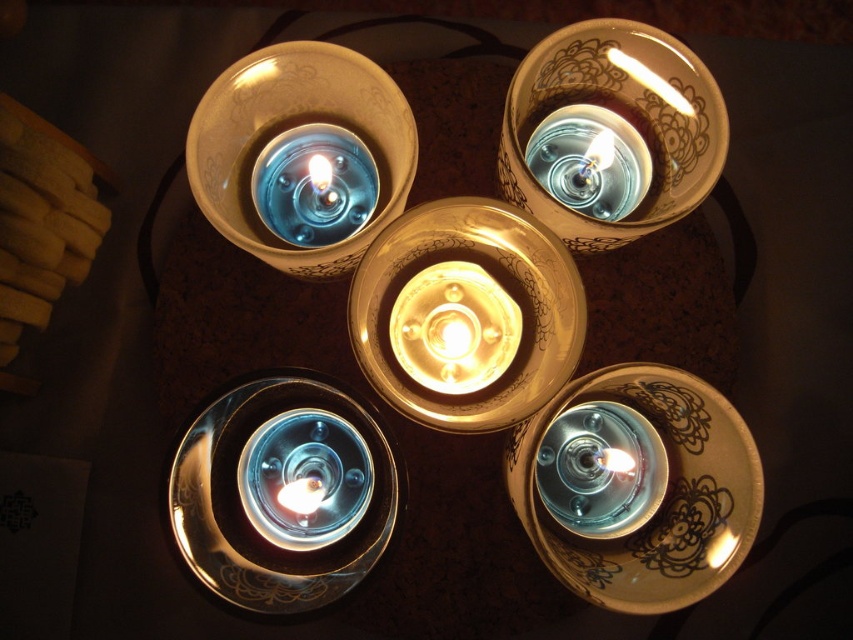
Is point (589, 116) closer to camera compared to point (614, 64)?

That is False.

Is point (534, 161) positioned after point (656, 81)?

Yes, point (534, 161) is farther from viewer.

The height and width of the screenshot is (640, 853). What do you see at coordinates (590, 161) in the screenshot? I see `translucent glass candle at upper center` at bounding box center [590, 161].

Where is `translucent glass candle at upper center`? This screenshot has width=853, height=640. translucent glass candle at upper center is located at coordinates (590, 161).

Who is positioned more to the right, matte ceramic candle holder at upper center or blue glass candle at upper left?

matte ceramic candle holder at upper center

Who is lower down, matte ceramic candle holder at upper center or blue glass candle at upper left?

Positioned lower is matte ceramic candle holder at upper center.

Is point (350, 120) positioned in front of point (328, 136)?

Yes.

Where is `matte ceramic candle holder at upper center`? This screenshot has width=853, height=640. matte ceramic candle holder at upper center is located at coordinates coord(286,122).

Between matte gold candle holder at center and matte gold candle at lower right, which one appears on the right side from the viewer's perspective?

Positioned to the right is matte gold candle at lower right.

Is the position of matte gold candle holder at center more distant than that of matte gold candle at lower right?

No, it is in front of matte gold candle at lower right.

Is point (473, 224) farther from camera compared to point (726, 536)?

Yes, point (473, 224) is behind point (726, 536).

Locate an element on the screen. This screenshot has height=640, width=853. matte gold candle holder at center is located at coordinates (466, 314).